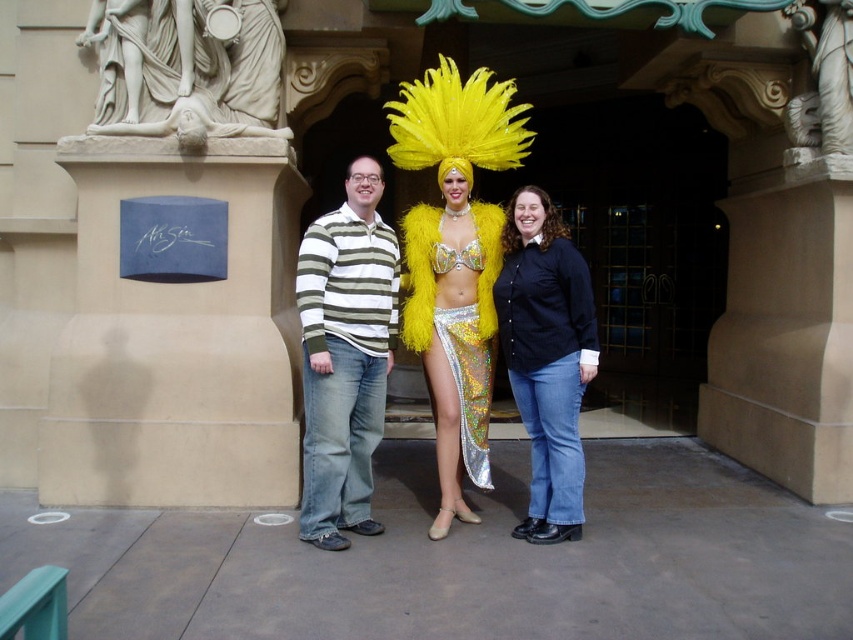
Between white marble statue at upper left and shiny sequined skirt at center, which one appears on the left side from the viewer's perspective?

From the viewer's perspective, white marble statue at upper left appears more on the left side.

How distant is white marble statue at upper left from shiny sequined skirt at center?

white marble statue at upper left and shiny sequined skirt at center are 6.65 feet apart from each other.

Locate an element on the screen. Image resolution: width=853 pixels, height=640 pixels. white marble statue at upper left is located at coordinates (187, 67).

Looking at this image, which is above, white marble statue at upper left or black button-up shirt at center?

white marble statue at upper left is higher up.

Between white marble statue at upper left and black button-up shirt at center, which one is positioned lower?

black button-up shirt at center

Does point (206, 77) come in front of point (526, 406)?

No, it is not.

The width and height of the screenshot is (853, 640). Identify the location of white marble statue at upper left. (187, 67).

Does striped cotton sweater at center appear over white marble statue at upper right?

No.

Who is lower down, striped cotton sweater at center or white marble statue at upper right?

striped cotton sweater at center

Locate an element on the screen. The width and height of the screenshot is (853, 640). striped cotton sweater at center is located at coordinates (345, 355).